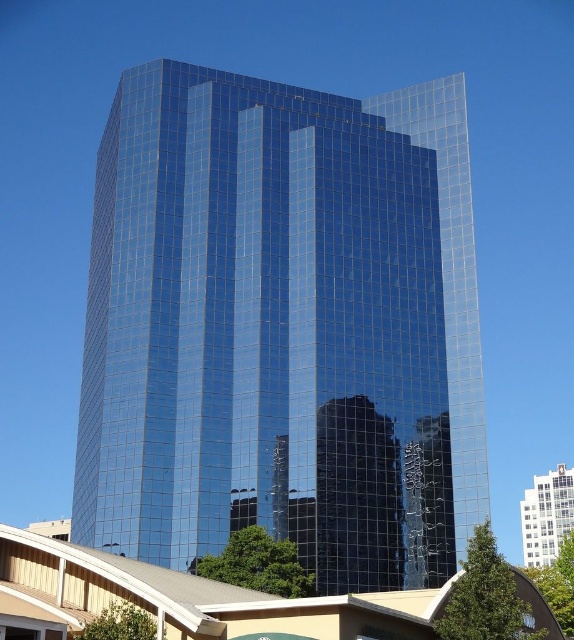
Does glossy glass tower at center lie in front of white glossy building at upper center?

Yes.

Between point (304, 394) and point (563, 488), which one is positioned in front?

Positioned in front is point (304, 394).

Who is more forward, (x=459, y=152) or (x=533, y=566)?

Point (x=459, y=152)

The height and width of the screenshot is (640, 574). Identify the location of glossy glass tower at center. (282, 328).